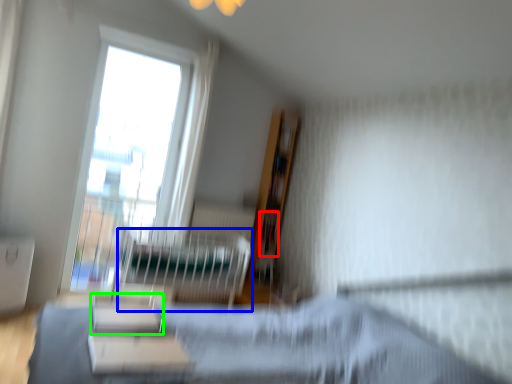
Question: Which is farther away from book (highlighted by a red box)? hospital bed (highlighted by a blue box) or furniture (highlighted by a green box)?

Choices:
 (A) hospital bed
 (B) furniture

Answer: (B)